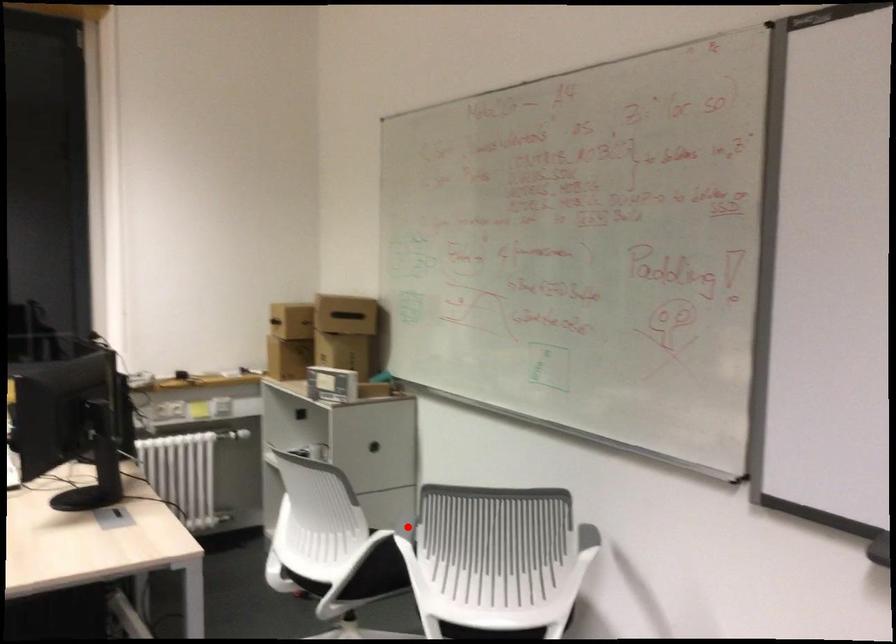
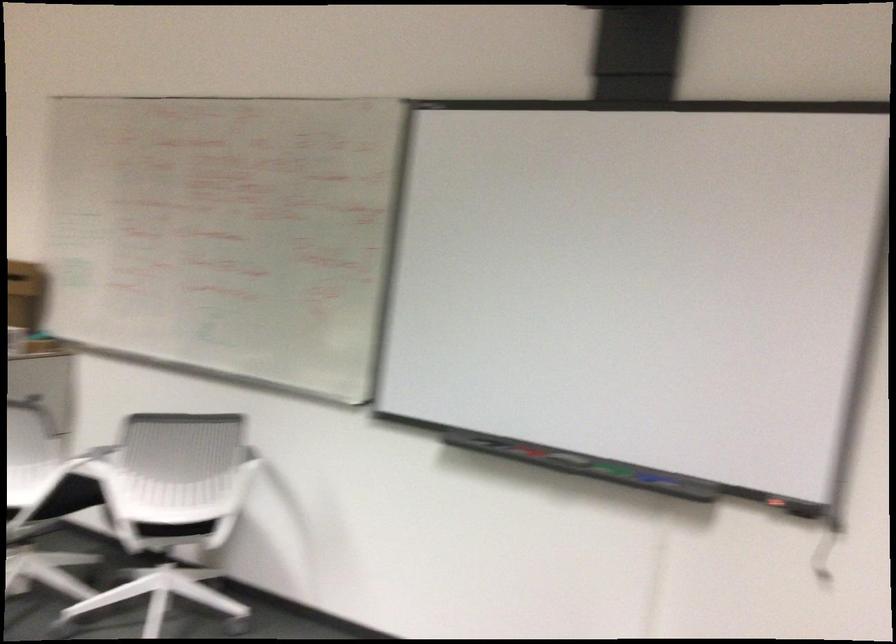
Question: I am providing you with two images of the same scene from different viewpoints. In image1, a red point is highlighted. Considering the same 3D point in image2, which of the following is correct?

Choices:
 (A) It is closer
 (B) It is farther

Answer: (B)